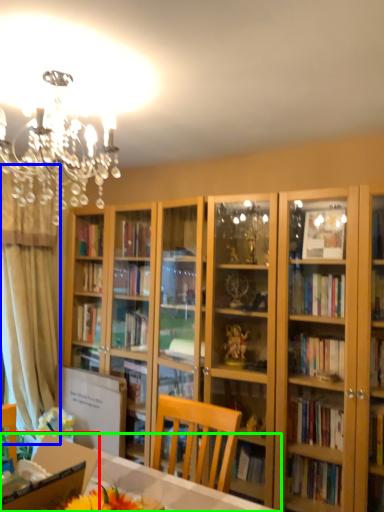
Question: Which object is positioned farthest from cardboard box (highlighted by a red box)? Select from curtain (highlighted by a blue box) and desk (highlighted by a green box).

Choices:
 (A) curtain
 (B) desk

Answer: (A)